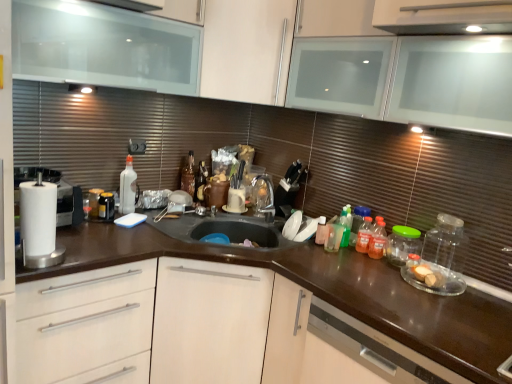
Question: Does satin brown dishwasher at lower right have a larger size compared to brown glossy countertop at center?

Choices:
 (A) no
 (B) yes

Answer: (A)

Question: Is satin brown dishwasher at lower right smaller than brown glossy countertop at center?

Choices:
 (A) yes
 (B) no

Answer: (A)

Question: Is satin brown dishwasher at lower right thinner than brown glossy countertop at center?

Choices:
 (A) yes
 (B) no

Answer: (A)

Question: From the image's perspective, is satin brown dishwasher at lower right located above brown glossy countertop at center?

Choices:
 (A) no
 (B) yes

Answer: (A)

Question: Would you say satin brown dishwasher at lower right is a long distance from brown glossy countertop at center?

Choices:
 (A) no
 (B) yes

Answer: (A)

Question: From a real-world perspective, is satin brown dishwasher at lower right under brown glossy countertop at center?

Choices:
 (A) yes
 (B) no

Answer: (B)

Question: Is satin brown dishwasher at lower right shorter than white glossy mug at center?

Choices:
 (A) yes
 (B) no

Answer: (B)

Question: Is satin brown dishwasher at lower right looking in the opposite direction of white glossy mug at center?

Choices:
 (A) no
 (B) yes

Answer: (A)

Question: Is satin brown dishwasher at lower right outside of white glossy mug at center?

Choices:
 (A) no
 (B) yes

Answer: (B)

Question: Are satin brown dishwasher at lower right and white glossy mug at center beside each other?

Choices:
 (A) yes
 (B) no

Answer: (B)

Question: From a real-world perspective, is satin brown dishwasher at lower right located beneath white glossy mug at center?

Choices:
 (A) yes
 (B) no

Answer: (A)

Question: Can you confirm if satin brown dishwasher at lower right is wider than white glossy mug at center?

Choices:
 (A) yes
 (B) no

Answer: (A)

Question: Does satin brown dishwasher at lower right appear on the left side of white matte drawer at lower left?

Choices:
 (A) no
 (B) yes

Answer: (A)